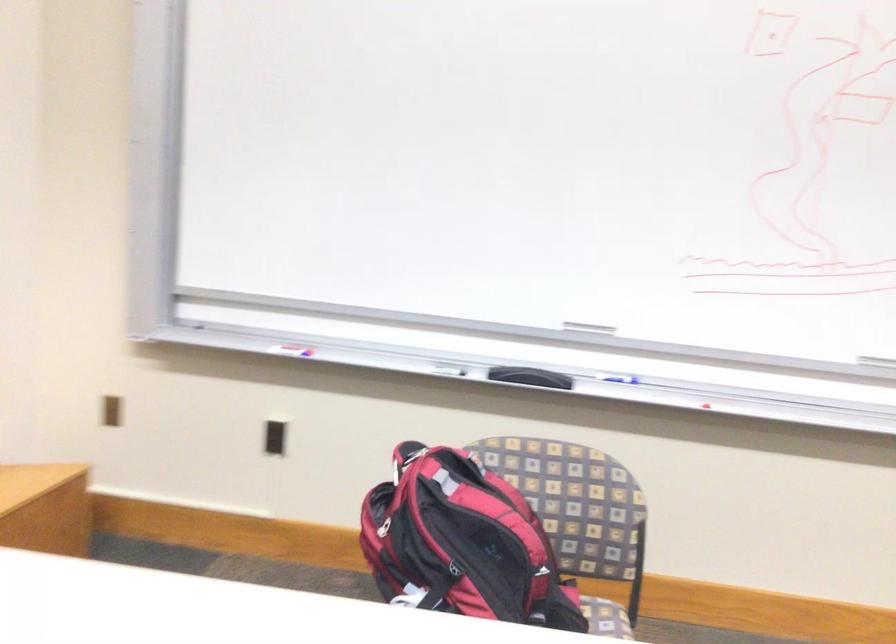
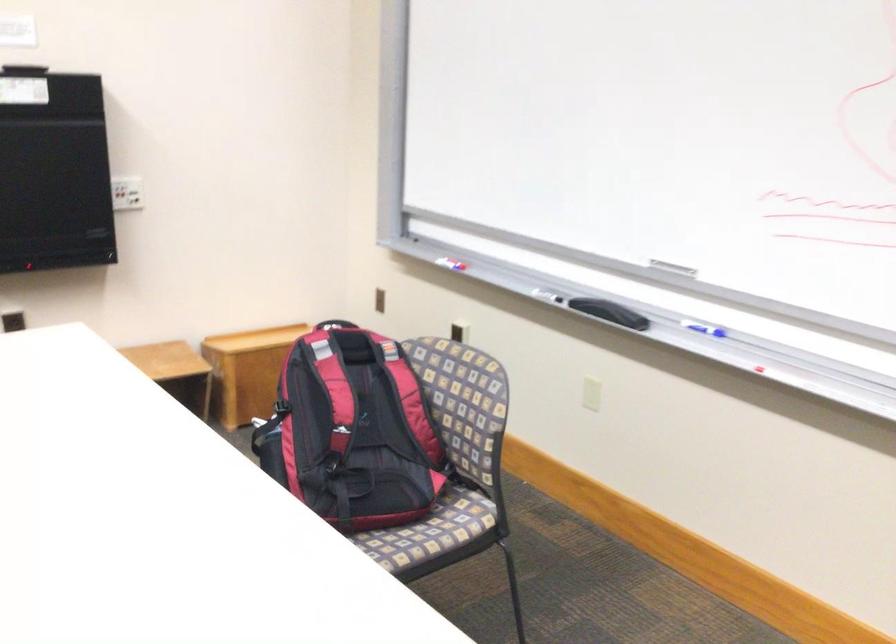
The point at (581, 327) is marked in the first image. Where is the corresponding point in the second image?

(672, 267)